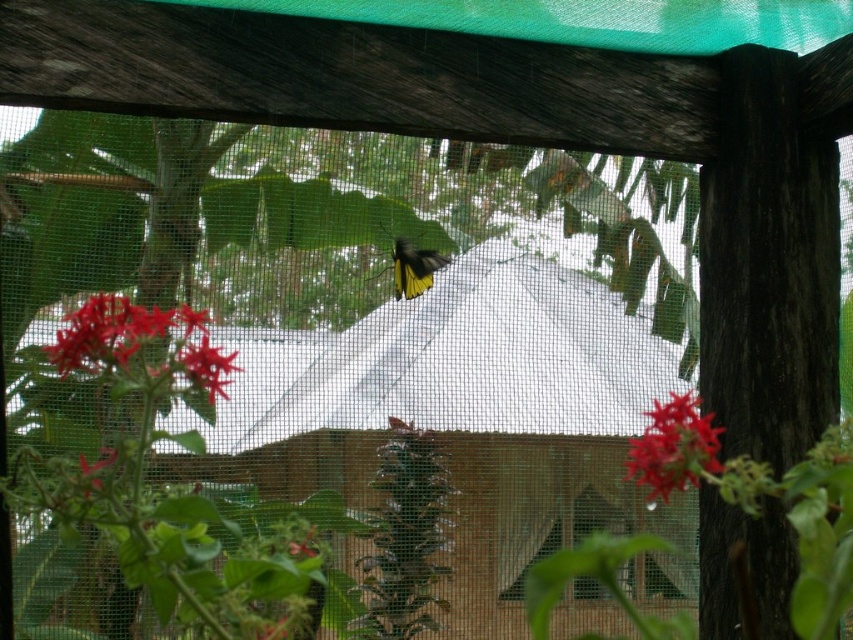
Question: Among these objects, which one is farthest from the camera?

Choices:
 (A) yellow matte butterfly at center
 (B) vivid red petals at lower left
 (C) smooth glossy red flower at center

Answer: (A)

Question: Is smooth glossy red flower at center above yellow matte butterfly at center?

Choices:
 (A) yes
 (B) no

Answer: (B)

Question: Which point appears closest to the camera in this image?

Choices:
 (A) (434, 262)
 (B) (685, 454)

Answer: (B)

Question: Which of the following is the farthest from the observer?

Choices:
 (A) yellow matte butterfly at center
 (B) vivid red petals at lower left

Answer: (A)

Question: Can you confirm if smooth glossy red flower at center is positioned to the left of yellow matte butterfly at center?

Choices:
 (A) yes
 (B) no

Answer: (B)

Question: Is the position of vivid red petals at lower left more distant than that of smooth glossy red flower at center?

Choices:
 (A) no
 (B) yes

Answer: (A)